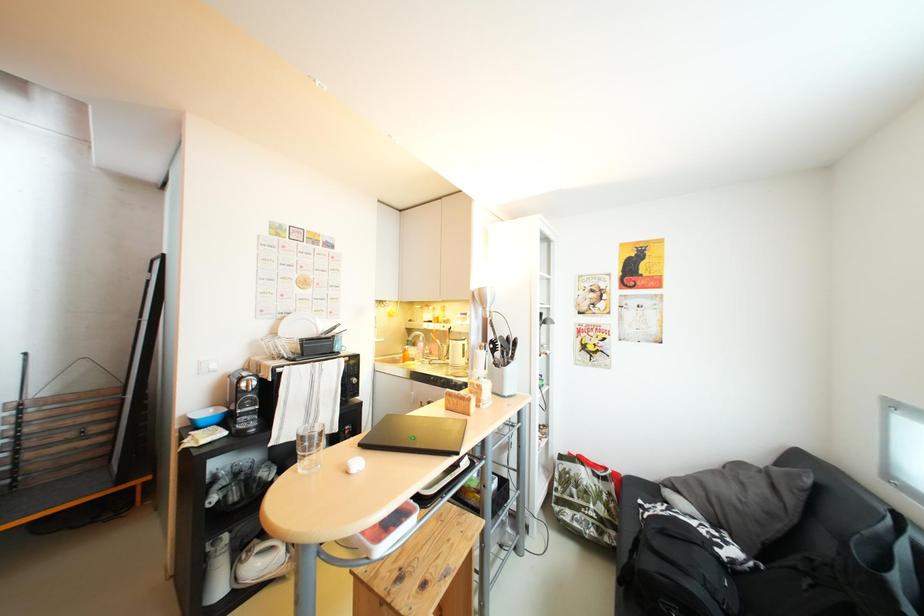
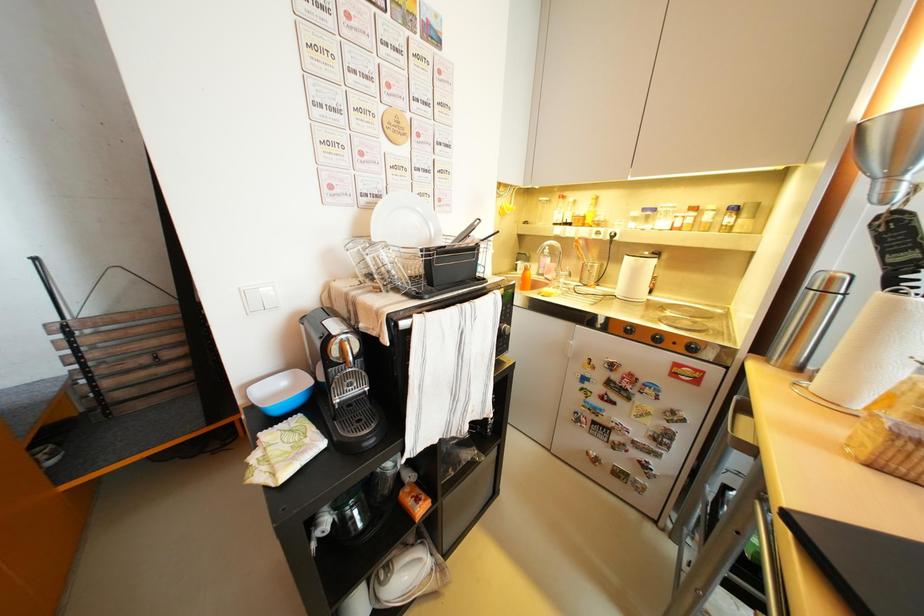
Based on the photo, what movement of the cameraman would produce the second image?

The cameraman walked toward left, forward.